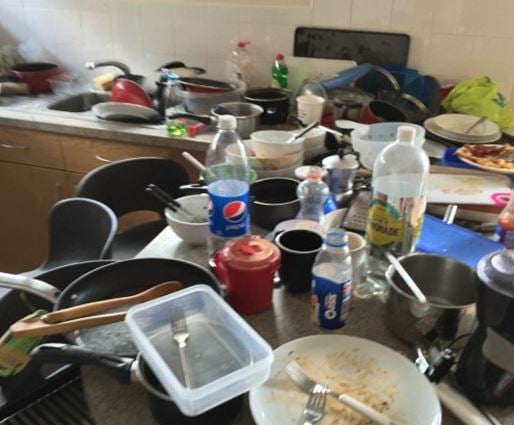
At what (x,y) coordinates should I click in order to perform the action: click on dish soap. Please return your answer as a coordinate pair (x, y). The height and width of the screenshot is (425, 514). Looking at the image, I should click on (279, 65), (238, 62).